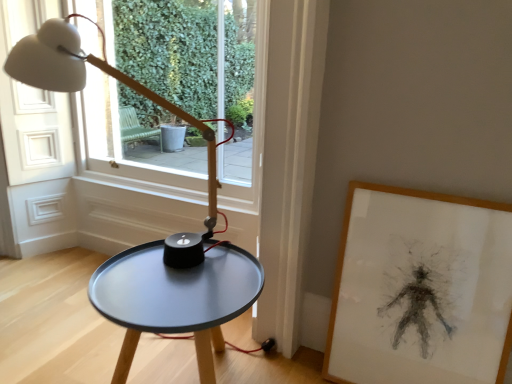
Question: Is matte black table at center wider or thinner than wooden framed drawing at right?

Choices:
 (A) thin
 (B) wide

Answer: (B)

Question: In the image, is matte black table at center on the left side or the right side of wooden framed drawing at right?

Choices:
 (A) right
 (B) left

Answer: (B)

Question: Which object is the closest to the transparent glass window at upper center?

Choices:
 (A) matte black table at center
 (B) wooden framed drawing at right

Answer: (A)

Question: Which object is positioned closest to the wooden framed drawing at right?

Choices:
 (A) matte black table at center
 (B) transparent glass window at upper center

Answer: (A)